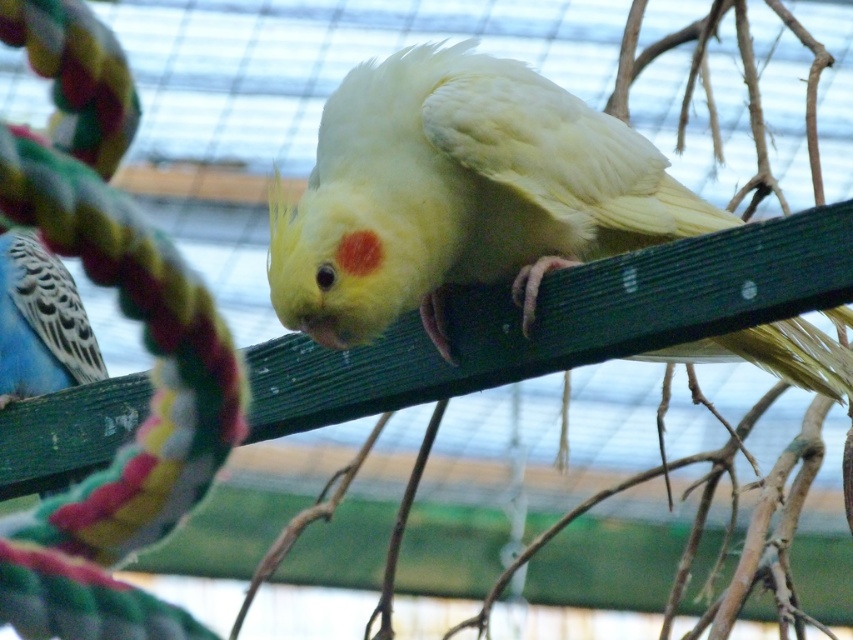
Question: Does white feathered parrot at center appear over blue speckled parrot at left?

Choices:
 (A) no
 (B) yes

Answer: (B)

Question: Is the position of white feathered parrot at center more distant than that of blue speckled parrot at left?

Choices:
 (A) no
 (B) yes

Answer: (A)

Question: Which of the following is the closest to the observer?

Choices:
 (A) 444,204
 (B) 16,385

Answer: (A)

Question: Is white feathered parrot at center below blue speckled parrot at left?

Choices:
 (A) yes
 (B) no

Answer: (B)

Question: Which of the following is the closest to the observer?

Choices:
 (A) white feathered parrot at center
 (B) blue speckled parrot at left

Answer: (A)